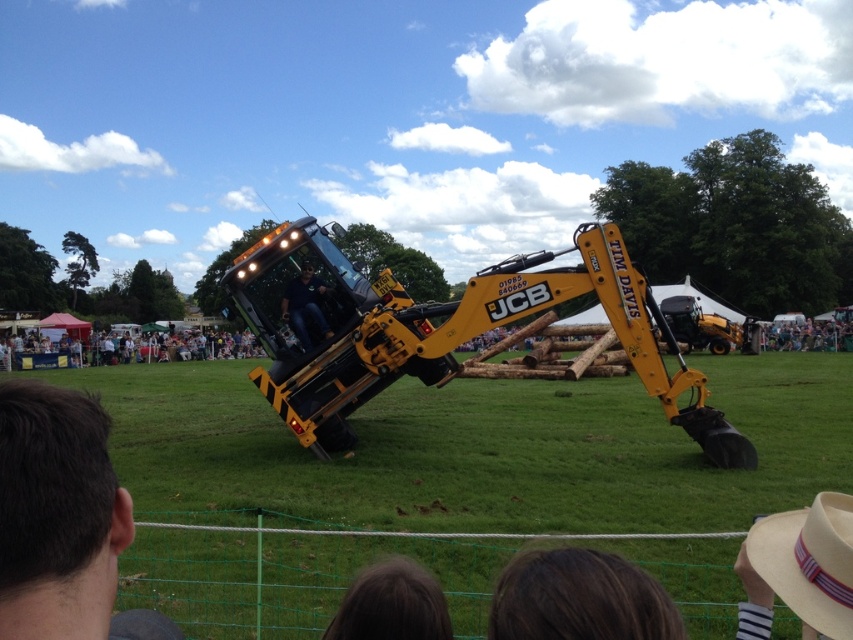
Consider the image. Does beige straw cowboy hat at lower right appear over brown hair at lower center?

Correct, beige straw cowboy hat at lower right is located above brown hair at lower center.

At what (x,y) coordinates should I click in order to perform the action: click on beige straw cowboy hat at lower right. Please return your answer as a coordinate pair (x, y). The height and width of the screenshot is (640, 853). Looking at the image, I should click on (799, 568).

This screenshot has width=853, height=640. What do you see at coordinates (799, 568) in the screenshot? I see `beige straw cowboy hat at lower right` at bounding box center [799, 568].

Image resolution: width=853 pixels, height=640 pixels. I want to click on beige straw cowboy hat at lower right, so click(799, 568).

Between green grass at center and dark brown hair at lower center, which one is positioned higher?

Positioned higher is dark brown hair at lower center.

Is green grass at center below dark brown hair at lower center?

Yes, green grass at center is below dark brown hair at lower center.

The image size is (853, 640). What do you see at coordinates (486, 449) in the screenshot? I see `green grass at center` at bounding box center [486, 449].

This screenshot has height=640, width=853. Find the location of `green grass at center`. green grass at center is located at coordinates (486, 449).

Does green grass at center appear on the left side of dark blue jeans at center?

No, green grass at center is not to the left of dark blue jeans at center.

Image resolution: width=853 pixels, height=640 pixels. In order to click on green grass at center in this screenshot , I will do `click(486, 449)`.